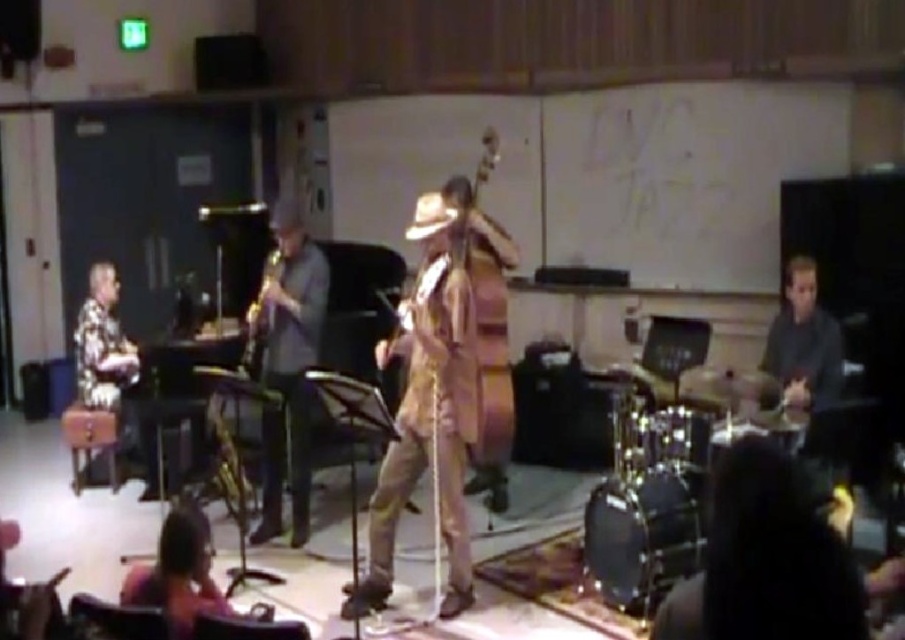
Does wooden polished cello at center appear on the left side of dark brown leather jacket at lower left?

In fact, wooden polished cello at center is to the right of dark brown leather jacket at lower left.

How distant is wooden polished cello at center from dark brown leather jacket at lower left?

wooden polished cello at center is 1.70 meters from dark brown leather jacket at lower left.

Is point (500, 269) in front of point (201, 513)?

No, (500, 269) is further to viewer.

You are a GUI agent. You are given a task and a screenshot of the screen. Output one action in this format:
    pyautogui.click(x=<x>, y=<y>)
    Task: Click on the wooden polished cello at center
    
    Given the screenshot: What is the action you would take?
    point(491,369)

Which is more to the left, black leather jacket at lower right or wooden polished cello at center?

wooden polished cello at center

Between black leather jacket at lower right and wooden polished cello at center, which one is positioned lower?

black leather jacket at lower right is lower down.

Measure the distance between point [767,612] and camera.

Point [767,612] is 5.01 feet from camera.

Where is `black leather jacket at lower right`? This screenshot has width=905, height=640. black leather jacket at lower right is located at coordinates (765, 561).

Which is more to the left, camouflage-patterned pantsuit at center or black leather jacket at lower right?

From the viewer's perspective, camouflage-patterned pantsuit at center appears more on the left side.

Who is more distant from viewer, (464, 244) or (787, 497)?

The point (464, 244) is behind.

Locate an element on the screen. This screenshot has width=905, height=640. camouflage-patterned pantsuit at center is located at coordinates (430, 401).